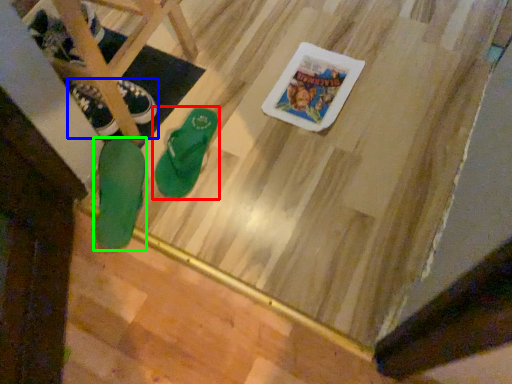
Question: Based on their relative distances, which object is farther from footwear (highlighted by a red box)? Choose from footwear (highlighted by a blue box) and footwear (highlighted by a green box).

Choices:
 (A) footwear
 (B) footwear

Answer: (A)